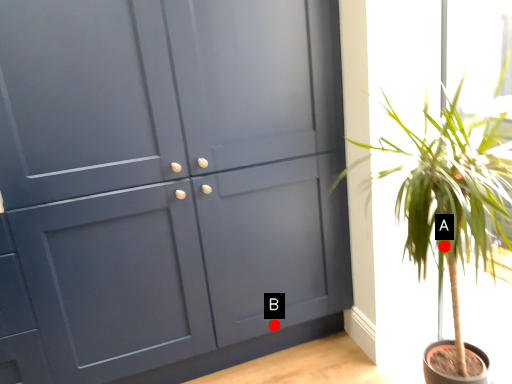
Question: Two points are circled on the image, labeled by A and B beside each circle. Which point is farther to the camera?

Choices:
 (A) A is further
 (B) B is further

Answer: (B)